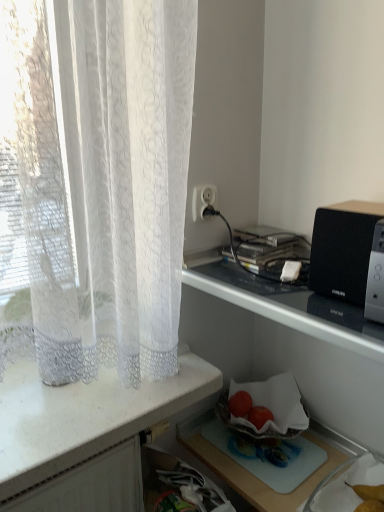
Identify the location of vacant space positioned to the left of smooth red strawberries at center, which is the second fruit from left to right. This screenshot has height=512, width=384. (224, 433).